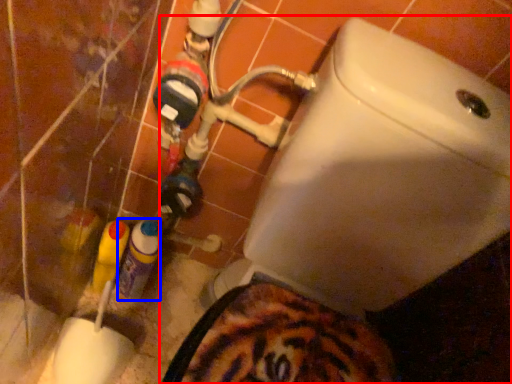
Question: Among these objects, which one is farthest to the camera, toilet (highlighted by a red box) or bottle (highlighted by a blue box)?

Choices:
 (A) toilet
 (B) bottle

Answer: (B)